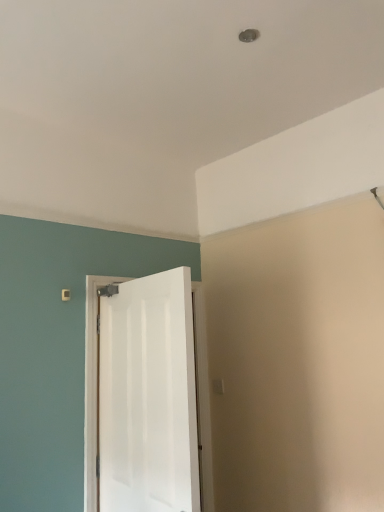
Where is `white matte door at left`? This screenshot has width=384, height=512. white matte door at left is located at coordinates (92, 384).

Describe the element at coordinates (92, 384) in the screenshot. I see `white matte door at left` at that location.

Find the location of a particular element. The image size is (384, 512). white matte door at left is located at coordinates (92, 384).